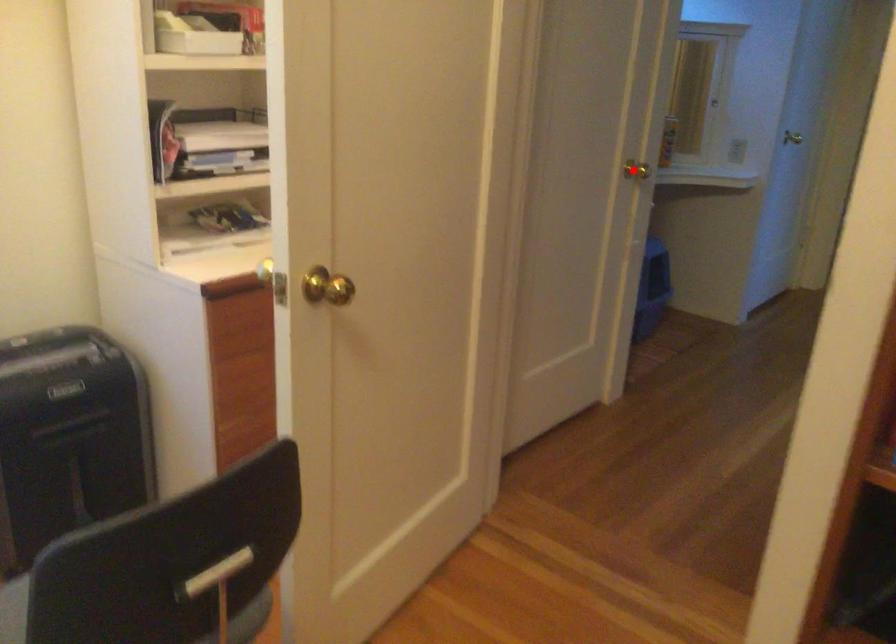
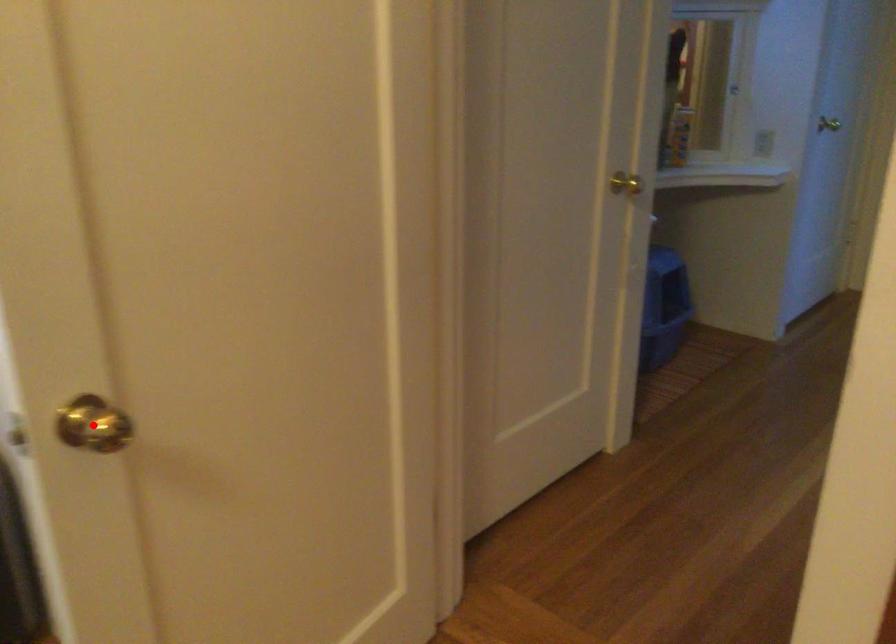
I am providing you with two images of the same scene from different viewpoints. A red point is marked on the first image and another point is marked on the second image. Are the points marked in image1 and image2 representing the same 3D position?

No